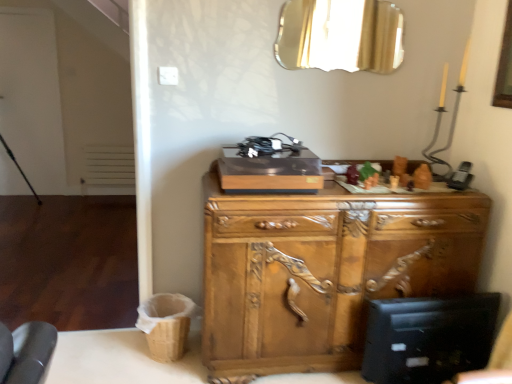
Question: Should I look upward or downward to see clear glass mirror at upper center?

Choices:
 (A) up
 (B) down

Answer: (A)

Question: Considering the relative sizes of wooden carved cabinet at center and clear glass mirror at upper center in the image provided, is wooden carved cabinet at center thinner than clear glass mirror at upper center?

Choices:
 (A) no
 (B) yes

Answer: (A)

Question: Is wooden carved cabinet at center to the right of clear glass mirror at upper center from the viewer's perspective?

Choices:
 (A) yes
 (B) no

Answer: (B)

Question: Can you see wooden carved cabinet at center touching clear glass mirror at upper center?

Choices:
 (A) yes
 (B) no

Answer: (B)

Question: From the image's perspective, is wooden carved cabinet at center over clear glass mirror at upper center?

Choices:
 (A) no
 (B) yes

Answer: (A)

Question: Does wooden carved cabinet at center have a greater height compared to clear glass mirror at upper center?

Choices:
 (A) no
 (B) yes

Answer: (B)

Question: Considering the relative sizes of wooden carved cabinet at center and clear glass mirror at upper center in the image provided, is wooden carved cabinet at center shorter than clear glass mirror at upper center?

Choices:
 (A) no
 (B) yes

Answer: (A)

Question: Is clear glass mirror at upper center positioned beyond the bounds of wooden carved cabinet at center?

Choices:
 (A) yes
 (B) no

Answer: (A)

Question: From a real-world perspective, does clear glass mirror at upper center sit lower than wooden carved cabinet at center?

Choices:
 (A) no
 (B) yes

Answer: (A)

Question: Is clear glass mirror at upper center oriented away from wooden carved cabinet at center?

Choices:
 (A) no
 (B) yes

Answer: (A)

Question: From a real-world perspective, does clear glass mirror at upper center stand above wooden carved cabinet at center?

Choices:
 (A) yes
 (B) no

Answer: (A)

Question: Would you say clear glass mirror at upper center is a long distance from wooden carved cabinet at center?

Choices:
 (A) no
 (B) yes

Answer: (B)

Question: Can you confirm if clear glass mirror at upper center is bigger than wooden carved cabinet at center?

Choices:
 (A) yes
 (B) no

Answer: (B)

Question: Considering the positions of clear glass mirror at upper center and wooden carved cabinet at center in the image, is clear glass mirror at upper center wider or thinner than wooden carved cabinet at center?

Choices:
 (A) wide
 (B) thin

Answer: (B)